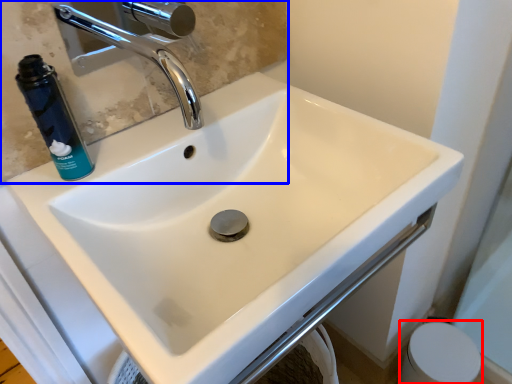
Question: Which point is closer to the camera, toilet paper (highlighted by a red box) or mirror (highlighted by a blue box)?

Choices:
 (A) toilet paper
 (B) mirror

Answer: (B)